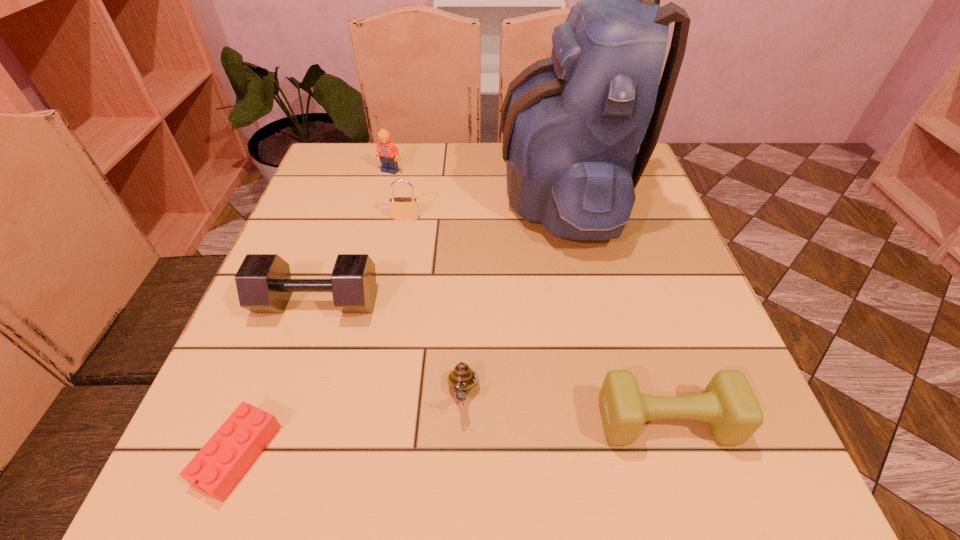
At what (x,y) coordinates should I click in order to perform the action: click on backpack. Please return your answer as a coordinate pair (x, y). This screenshot has height=540, width=960. Looking at the image, I should click on (572, 124).

This screenshot has height=540, width=960. I want to click on the taller Lego, so click(388, 153).

Image resolution: width=960 pixels, height=540 pixels. Identify the location of the farther Lego. (388, 153).

This screenshot has height=540, width=960. I want to click on padlock, so click(x=402, y=208).

The height and width of the screenshot is (540, 960). Identify the location of the fourth nearest object. (264, 285).

Where is `the left dumbbell`? The width and height of the screenshot is (960, 540). the left dumbbell is located at coordinates (264, 285).

This screenshot has height=540, width=960. Find the location of `the fifth object from left to right`. the fifth object from left to right is located at coordinates (462, 379).

Where is `the nearer dumbbell`? the nearer dumbbell is located at coordinates (728, 404).

This screenshot has height=540, width=960. I want to click on the shorter dumbbell, so click(728, 404).

The image size is (960, 540). Find the location of `the shortest object`. the shortest object is located at coordinates (217, 468).